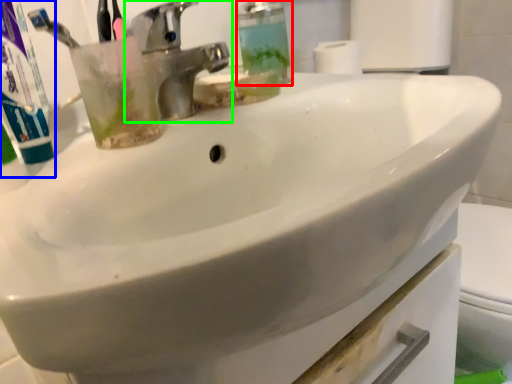
Question: Which object is positioned closest to soap dispenser (highlighted by a red box)? Select from toothpaste (highlighted by a blue box) and tap (highlighted by a green box).

Choices:
 (A) toothpaste
 (B) tap

Answer: (B)